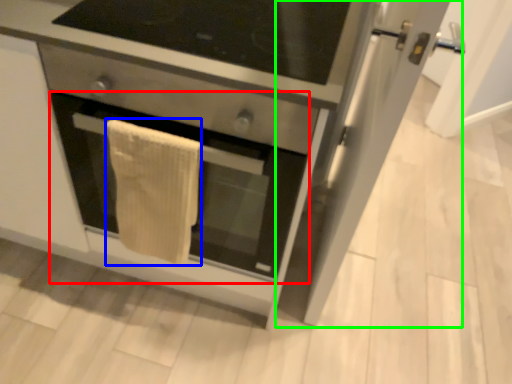
Question: Based on their relative distances, which object is nearer to oven (highlighted by a red box)? Choose from bath towel (highlighted by a blue box) and glass door (highlighted by a green box).

Choices:
 (A) bath towel
 (B) glass door

Answer: (A)